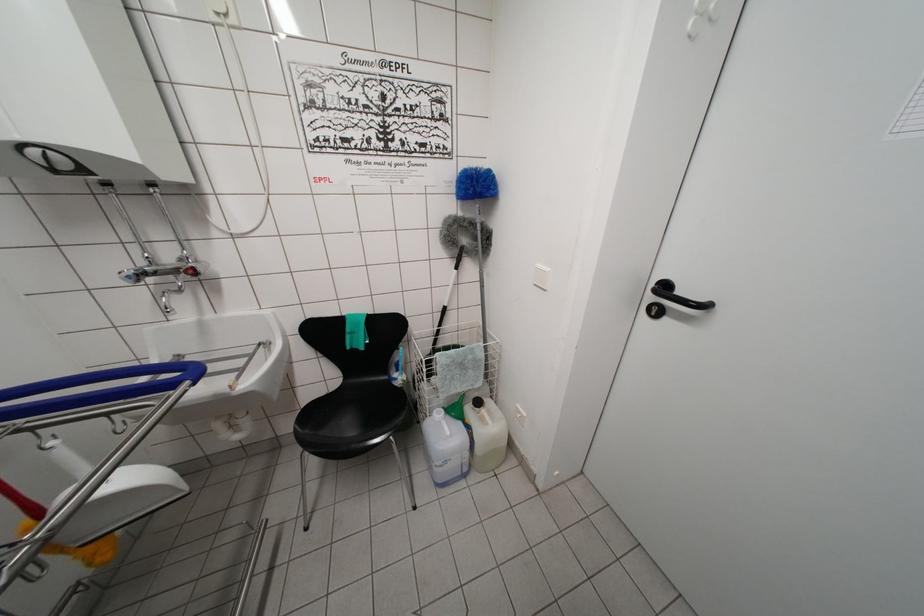
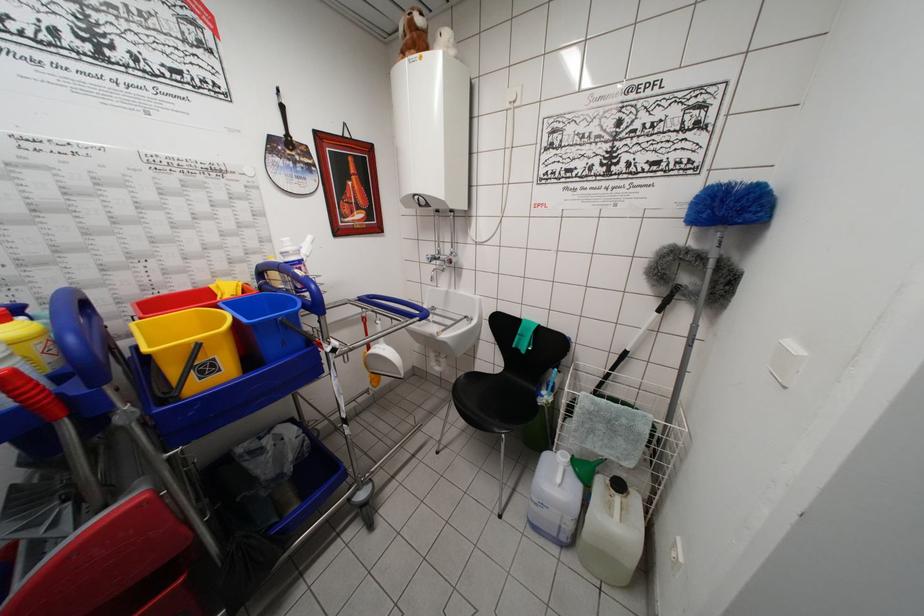
The point at [438,418] is marked in the first image. Where is the corresponding point in the second image?

(563, 456)